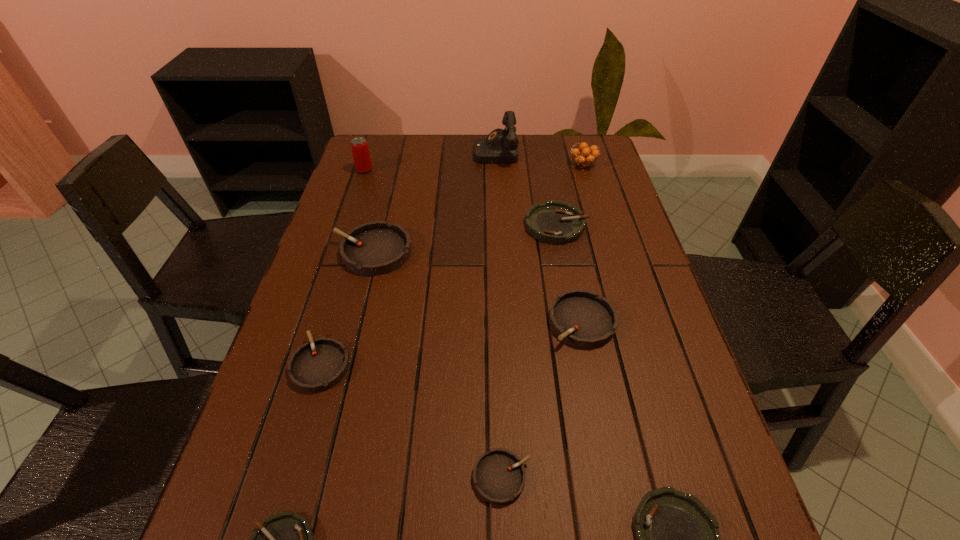
Identify the location of the second smallest gray ashtray. (318, 365).

Image resolution: width=960 pixels, height=540 pixels. I want to click on the farthest green ashtray, so click(555, 222).

Image resolution: width=960 pixels, height=540 pixels. In order to click on the third gray ashtray from left to right in this screenshot , I will do `click(499, 475)`.

Locate an element on the screen. Image resolution: width=960 pixels, height=540 pixels. the fourth ashtray from left to right is located at coordinates (499, 475).

Identify the location of free region located 0.310m on the dial of the tallest object. (386, 152).

Where is `vacant space located 0.320m on the dial of the tallest object`? The image size is (960, 540). vacant space located 0.320m on the dial of the tallest object is located at coordinates (383, 152).

Where is `vacant space located 0.230m on the dial of the tallest object`? vacant space located 0.230m on the dial of the tallest object is located at coordinates (409, 152).

The image size is (960, 540). Identify the location of free space located 0.070m on the right of the pink beer can. (394, 170).

In order to click on vacant space positioned 0.310m on the front of the orange orange fruit in this screenshot , I will do `click(604, 234)`.

You are a GUI agent. You are given a task and a screenshot of the screen. Output one action in this format:
    pyautogui.click(x=<x>, y=<y>)
    Task: Click on the vacant space located on the back of the tallest ashtray
    This screenshot has width=960, height=540.
    Given the screenshot: What is the action you would take?
    pyautogui.click(x=388, y=188)